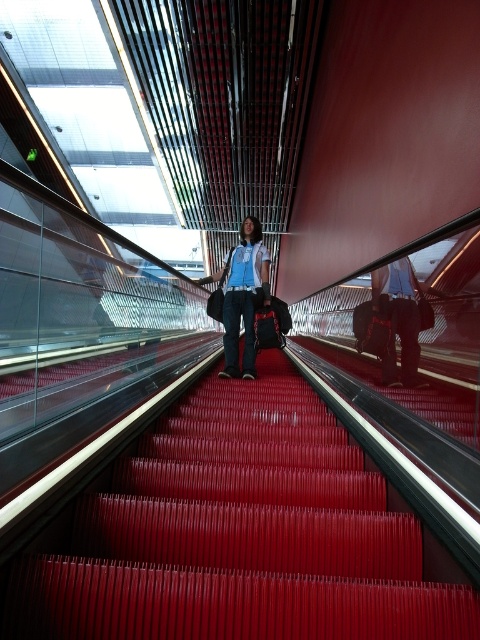
Is red rubber stairs at center positioned in front of matte blue shirt at center?

Yes, red rubber stairs at center is closer to the viewer.

Can you confirm if red rubber stairs at center is smaller than matte blue shirt at center?

Indeed, red rubber stairs at center has a smaller size compared to matte blue shirt at center.

Is point (292, 541) in front of point (238, 310)?

Yes.

This screenshot has width=480, height=640. Find the location of `red rubber stairs at center`. red rubber stairs at center is located at coordinates (239, 534).

In the scene shown: Can you confirm if red rubber stairs at center is positioned below matte black pants at center?

Yes.

Can you confirm if red rubber stairs at center is positioned above matte black pants at center?

Incorrect, red rubber stairs at center is not positioned above matte black pants at center.

Is point (252, 524) farther from viewer compared to point (373, 276)?

No, it is in front of (373, 276).

Where is `red rubber stairs at center`? This screenshot has height=640, width=480. red rubber stairs at center is located at coordinates (239, 534).

How much distance is there between matte blue shirt at center and matte black pants at center?

matte blue shirt at center and matte black pants at center are 5.55 feet apart from each other.

Measure the distance between matte blue shirt at center and camera.

matte blue shirt at center is 12.47 feet from camera.

Between point (235, 264) and point (369, 336), which one is positioned behind?

Positioned behind is point (235, 264).

Image resolution: width=480 pixels, height=640 pixels. What are the coordinates of `matte blue shirt at center` in the screenshot? It's located at (242, 296).